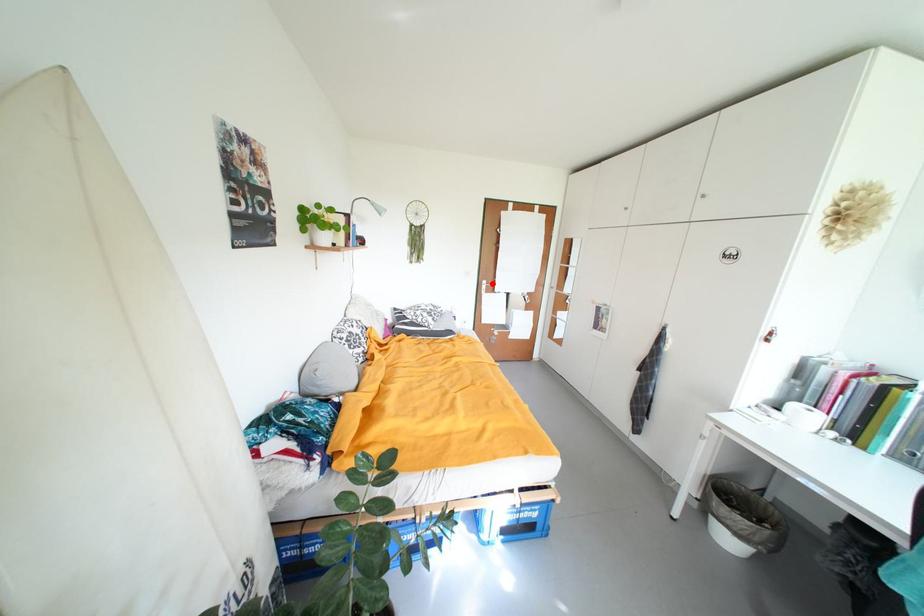
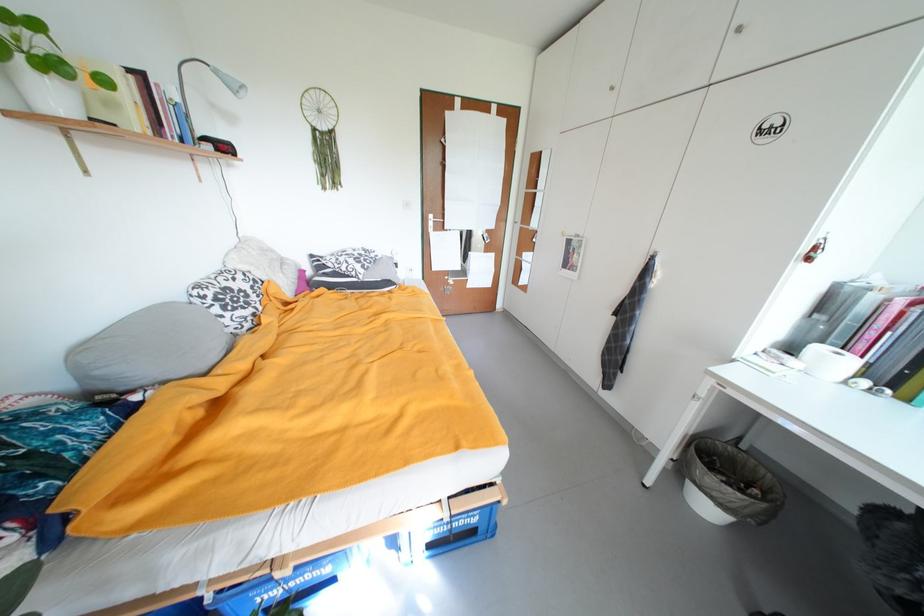
Question: I am providing you with two images of the same scene from different viewpoints. Given a red point in image1, look at the same physical point in image2. Is it:

Choices:
 (A) Closer to the viewpoint
 (B) Farther from the viewpoint

Answer: (A)